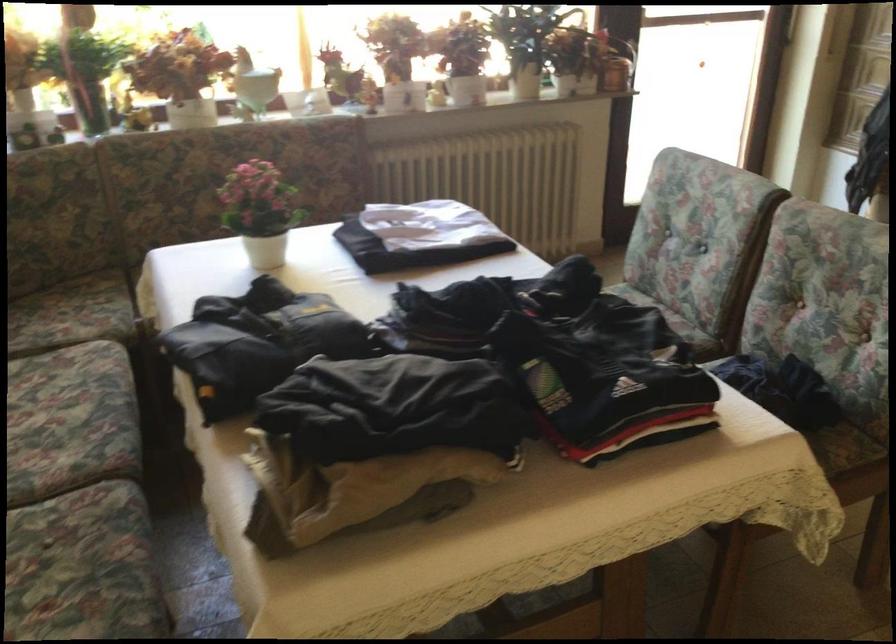
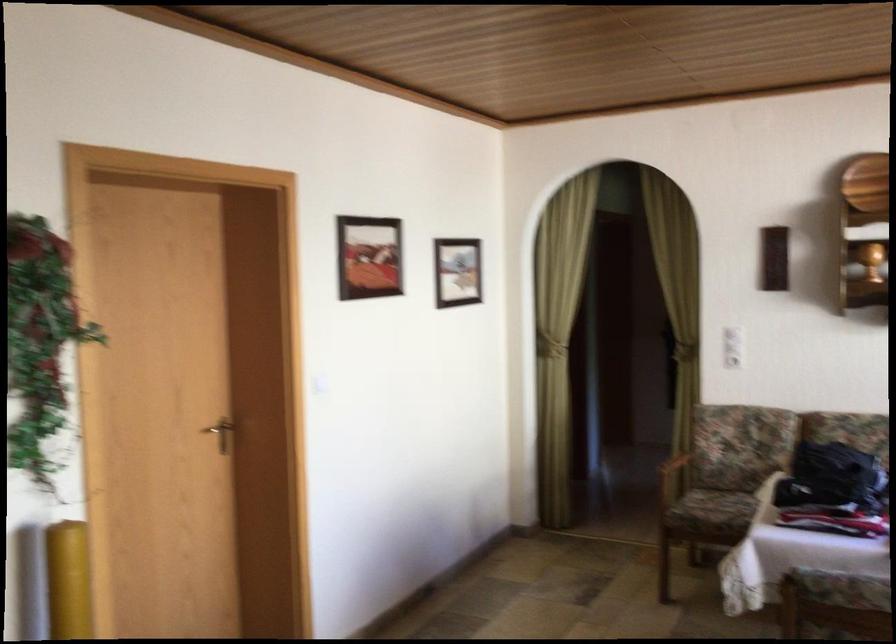
Question: I am providing you with two images of the same scene from different viewpoints. Please identify which objects are invisible in image2.

Choices:
 (A) yellow cylinder
 (B) chair armrest
 (C) chair sitting surface
 (D) none of these

Answer: (D)